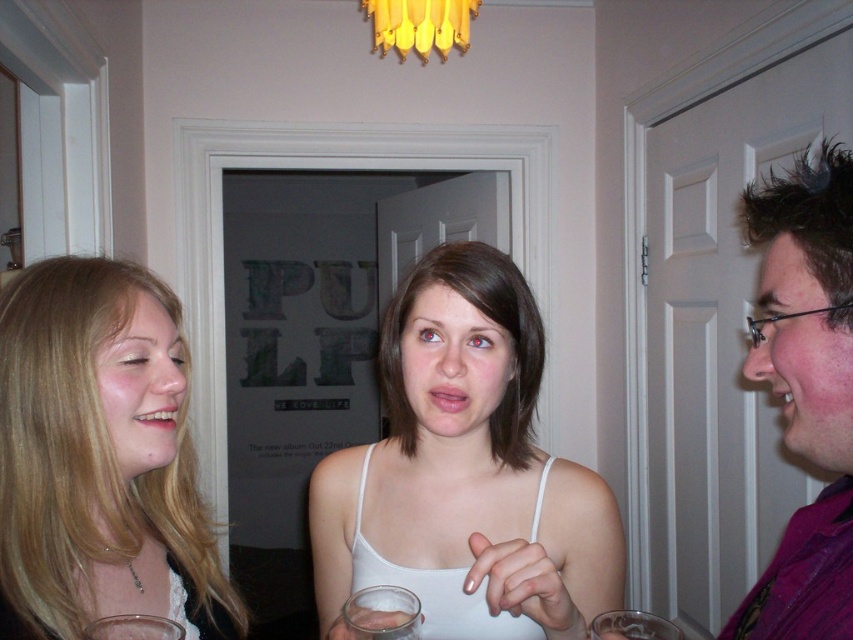
You are at a party and want to grab a drink. You see the blonde hair at left and the transparent glass at center. Which object is bigger in size?

The blonde hair at left is larger in size compared to the transparent glass at center.

You are a photographer at the party and want to capture a photo of the white fabric tank top at center and the clear glass wine glass at lower left. If you frame the shot so that both objects are visible, which object will appear wider in the photo?

The white fabric tank top at center will appear wider in the photo because its width surpasses that of the clear glass wine glass at lower left.